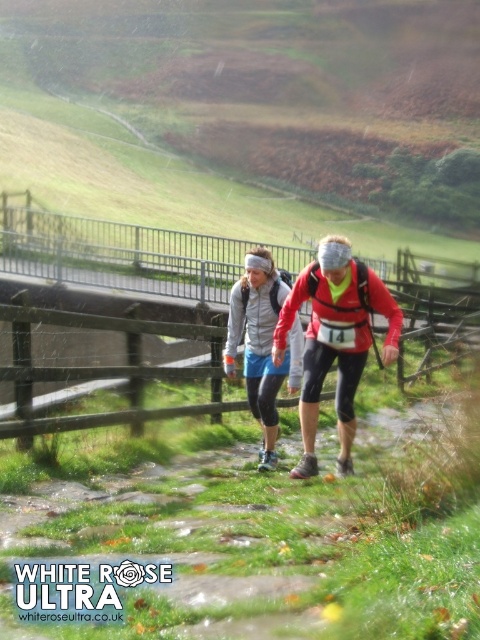
Can you confirm if wooden at center is wider than matte red jacket at center?

Yes, wooden at center is wider than matte red jacket at center.

Where is `wooden at center`? The image size is (480, 640). wooden at center is located at coordinates click(116, 253).

Which is more to the left, matte red jacket at center or matte gray jacket at center?

From the viewer's perspective, matte gray jacket at center appears more on the left side.

Is matte red jacket at center wider than matte gray jacket at center?

Indeed, matte red jacket at center has a greater width compared to matte gray jacket at center.

Is point (290, 317) more distant than point (279, 369)?

That is False.

Where is `matte red jacket at center`? matte red jacket at center is located at coordinates (335, 339).

Can you confirm if wooden at center is taller than matte gray jacket at center?

Yes, wooden at center is taller than matte gray jacket at center.

Is point (28, 216) positioned behind point (269, 451)?

Yes, it is behind point (269, 451).

Who is more distant from viewer, (135,282) or (283,284)?

Positioned behind is point (135,282).

Locate an element on the screen. Image resolution: width=480 pixels, height=640 pixels. wooden at center is located at coordinates (116, 253).